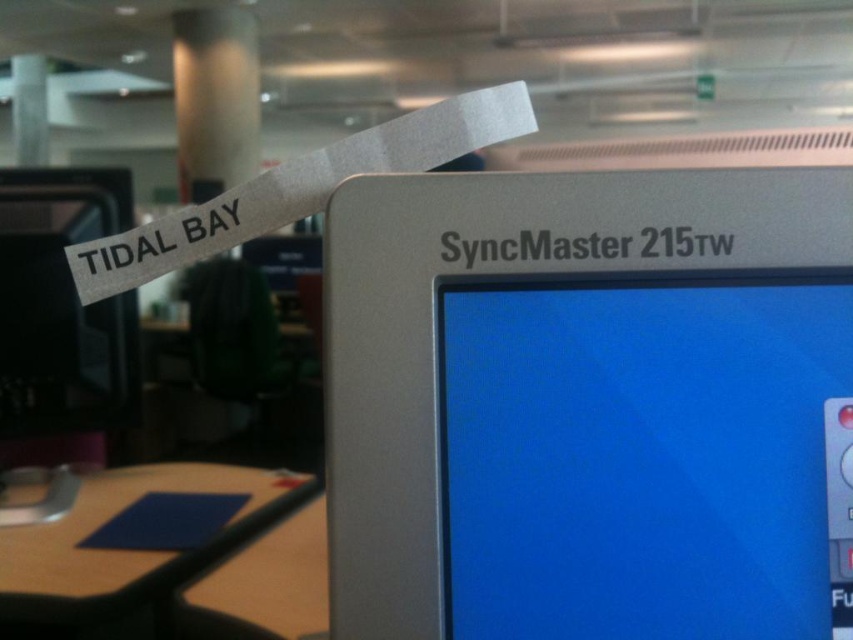
Question: Which of the following is the closest to the observer?

Choices:
 (A) blue matte table at lower left
 (B) silver metallic monitor at center

Answer: (B)

Question: Is matte black monitor at left smaller than blue matte table at lower left?

Choices:
 (A) yes
 (B) no

Answer: (B)

Question: Does silver metallic monitor at center appear on the left side of matte black monitor at left?

Choices:
 (A) no
 (B) yes

Answer: (A)

Question: Does silver metallic monitor at center appear over blue matte table at lower left?

Choices:
 (A) no
 (B) yes

Answer: (B)

Question: Among these objects, which one is farthest from the camera?

Choices:
 (A) silver metallic monitor at center
 (B) blue matte table at lower left

Answer: (B)

Question: Considering the real-world distances, which object is farthest from the silver metallic monitor at center?

Choices:
 (A) matte black monitor at left
 (B) blue matte table at lower left

Answer: (A)